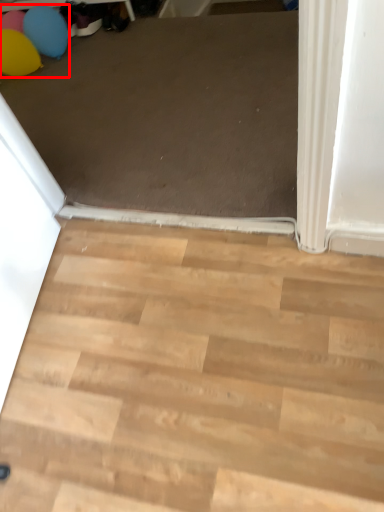
Question: Considering the relative positions of balloon (annotated by the red box) and stairwell in the image provided, where is balloon (annotated by the red box) located with respect to the staircase?

Choices:
 (A) right
 (B) left

Answer: (B)